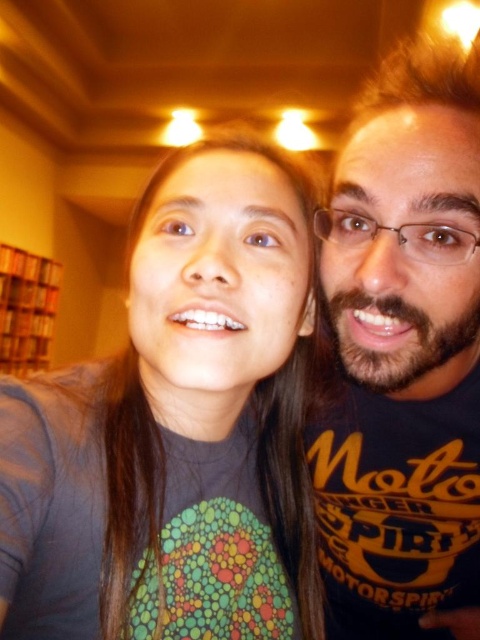
Question: Can you confirm if dark blue t-shirt at right is smaller than wooden bookshelf at left?

Choices:
 (A) no
 (B) yes

Answer: (B)

Question: Among these points, which one is nearest to the camera?

Choices:
 (A) (0, 362)
 (B) (354, 305)
 (C) (200, 268)

Answer: (C)

Question: Which object is the farthest from the wooden bookshelf at left?

Choices:
 (A) dark blue t-shirt at right
 (B) gray matte shirt at center

Answer: (B)

Question: Which of the following is the farthest from the observer?

Choices:
 (A) gray matte shirt at center
 (B) dark blue t-shirt at right

Answer: (B)

Question: Does gray matte shirt at center have a smaller size compared to dark blue t-shirt at right?

Choices:
 (A) yes
 (B) no

Answer: (A)

Question: Is gray matte shirt at center wider than dark blue t-shirt at right?

Choices:
 (A) yes
 (B) no

Answer: (B)